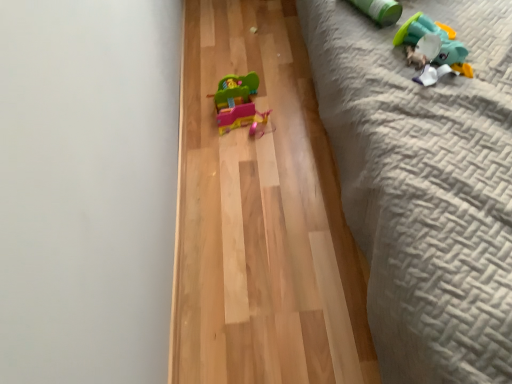
Question: Is matte plastic toy at center, which appears as the 3th toy when viewed from the right, inside the boundaries of textured gray quilt at right, or outside?

Choices:
 (A) inside
 (B) outside

Answer: (B)

Question: Considering the positions of matte plastic toy at center, acting as the first toy starting from the left, and textured gray quilt at right in the image, is matte plastic toy at center, acting as the first toy starting from the left, wider or thinner than textured gray quilt at right?

Choices:
 (A) wide
 (B) thin

Answer: (B)

Question: Estimate the real-world distances between objects in this image. Which object is closer to the plush green duck at upper right, positioned as the third toy in left-to-right order?

Choices:
 (A) matte plastic toy at center, acting as the first toy starting from the left
 (B) light brown wood flooring at center
 (C) textured gray quilt at right
 (D) green matte cylinder at upper right, placed as the 2th toy when sorted from front to back

Answer: (D)

Question: Which of these objects is positioned farthest from the matte plastic toy at center, the third toy positioned from the front?

Choices:
 (A) green matte cylinder at upper right, the 2th toy when ordered from left to right
 (B) light brown wood flooring at center
 (C) plush green duck at upper right, positioned as the third toy in left-to-right order
 (D) textured gray quilt at right

Answer: (D)